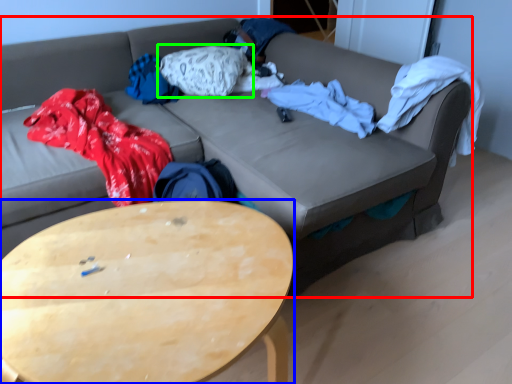
Question: Which object is positioned farthest from studio couch (highlighted by a red box)? Select from coffee table (highlighted by a blue box) and pillow (highlighted by a green box).

Choices:
 (A) coffee table
 (B) pillow

Answer: (A)